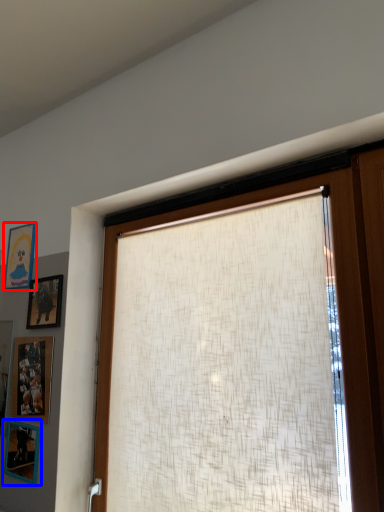
Question: Which point is further to the camera, picture frame (highlighted by a red box) or picture frame (highlighted by a blue box)?

Choices:
 (A) picture frame
 (B) picture frame

Answer: (A)